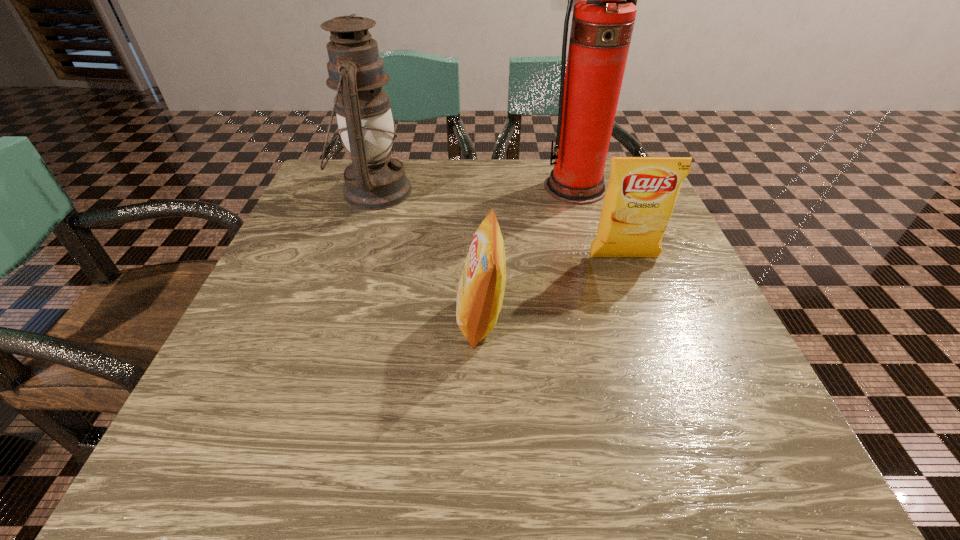
In the image, there is a desktop. Identify the location of vacant space at the far edge. (449, 174).

Identify the location of vacant region at the near edge. The width and height of the screenshot is (960, 540). (558, 459).

This screenshot has height=540, width=960. What are the coordinates of `free spot at the left edge of the desktop` in the screenshot? It's located at (304, 306).

You are a GUI agent. You are given a task and a screenshot of the screen. Output one action in this format:
    pyautogui.click(x=<x>, y=<y>)
    Task: Click on the vacant space at the right edge of the desktop
    The width and height of the screenshot is (960, 540).
    Given the screenshot: What is the action you would take?
    pyautogui.click(x=745, y=367)

Identify the location of free space at the far left corner. (333, 195).

In the image, there is a desktop. Where is `free space at the near right corner`? free space at the near right corner is located at coordinates (750, 430).

This screenshot has height=540, width=960. Find the location of `free spot between the oil lamp and the tallest object`. free spot between the oil lamp and the tallest object is located at coordinates (474, 189).

In order to click on vacant region between the oil lamp and the nearer crisp (potato chip) in this screenshot , I will do `click(427, 255)`.

Locate an element on the screen. Image resolution: width=960 pixels, height=540 pixels. unoccupied position between the left crisp (potato chip) and the taller crisp (potato chip) is located at coordinates (552, 288).

This screenshot has height=540, width=960. What are the coordinates of `free space between the fire extinguisher and the leftmost object` in the screenshot? It's located at (474, 189).